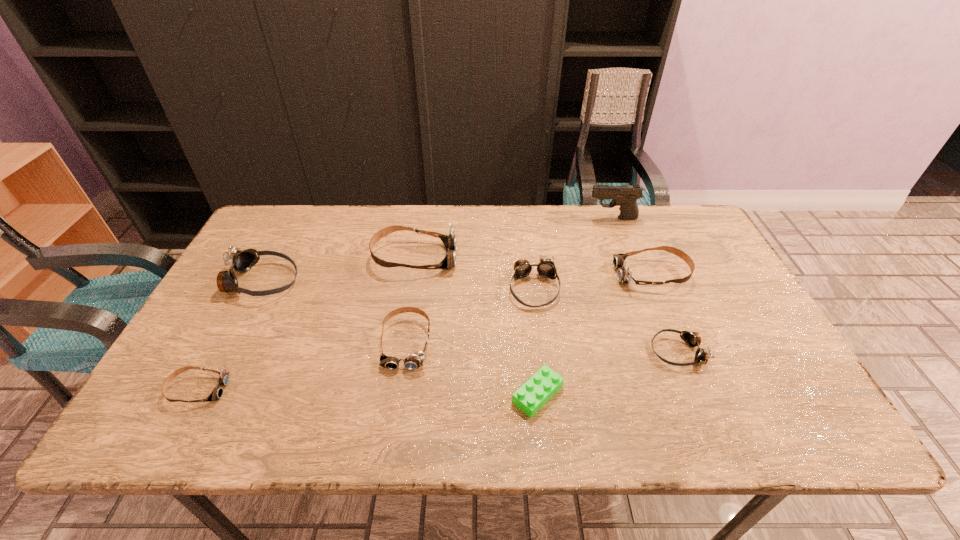
The image size is (960, 540). I want to click on vacant space located 0.140m on the front-facing side of the rightmost brown goggles, so click(x=567, y=274).

This screenshot has height=540, width=960. Identify the location of vacant space located 0.170m through the lenses of the second bronze goggles from right to left. (543, 363).

Locate an element on the screen. This screenshot has height=540, width=960. vacant position located on the front-facing side of the second nearest brown goggles is located at coordinates (396, 409).

This screenshot has height=540, width=960. What are the coordinates of `vacant space situated 0.120m through the lenses of the nearest bronze goggles` in the screenshot? It's located at click(602, 352).

You are a GUI agent. You are given a task and a screenshot of the screen. Output one action in this format:
    pyautogui.click(x=<x>, y=<y>)
    Task: Click on the free space located 0.200m through the lenses of the nearest bronze goggles
    This screenshot has height=540, width=960.
    Given the screenshot: What is the action you would take?
    pyautogui.click(x=569, y=352)

This screenshot has width=960, height=540. What are the coordinates of `free location located through the lenses of the nearest bronze goggles` in the screenshot? It's located at (618, 352).

Identify the location of vacant area situated on the front-facing side of the nearest brown goggles. (283, 389).

I want to click on vacant region located 0.390m on the right of the Lego, so click(x=738, y=394).

Where is `pistol that is at the far edge`? The height and width of the screenshot is (540, 960). pistol that is at the far edge is located at coordinates (625, 196).

In order to click on goggles at the far edge in this screenshot , I will do `click(449, 240)`.